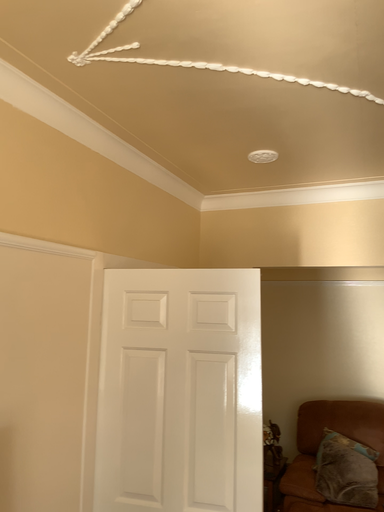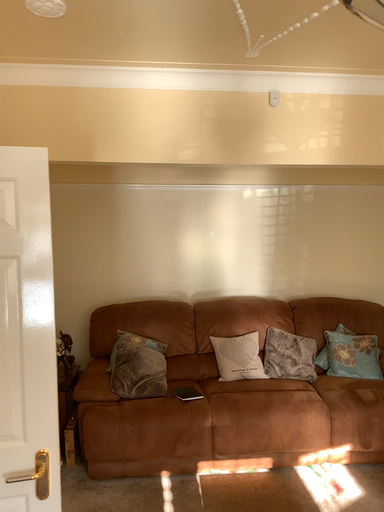
Question: How did the camera likely rotate when shooting the video?

Choices:
 (A) rotated left
 (B) rotated right

Answer: (B)